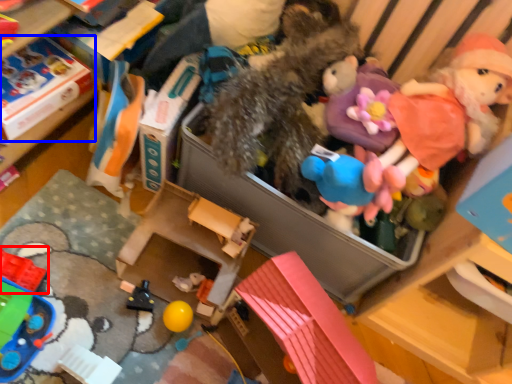
Question: Which object is closer to the camera taking this photo, toy (highlighted by a red box) or storage box (highlighted by a blue box)?

Choices:
 (A) toy
 (B) storage box

Answer: (A)